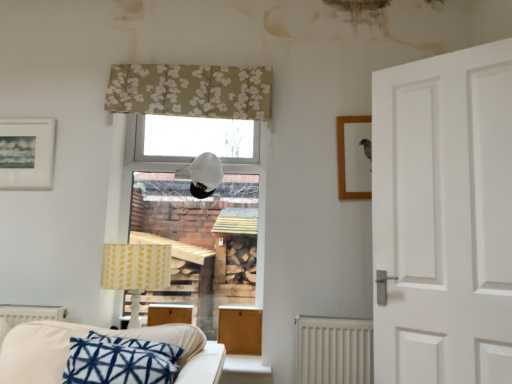
Find the location of a particular element. This screenshot has height=384, width=512. yellow fabric lampshade at lower left, the 2th table lamp viewed from the right is located at coordinates (136, 269).

What do you see at coordinates (240, 329) in the screenshot?
I see `wooden box at center` at bounding box center [240, 329].

The image size is (512, 384). What do you see at coordinates (202, 175) in the screenshot?
I see `white matte table lamp at center, marked as the 1th table lamp in a top-to-bottom arrangement` at bounding box center [202, 175].

Find the location of a particular element. The image size is (512, 384). wooden picture frame at upper right, which is the 1th picture frame from right to left is located at coordinates (354, 157).

The height and width of the screenshot is (384, 512). What are the coordinates of `matte white picture frame at upper left, the second picture frame positioned from the right` in the screenshot? It's located at (26, 154).

What do you see at coordinates (26, 154) in the screenshot? The image size is (512, 384). I see `matte white picture frame at upper left, the second picture frame positioned from the right` at bounding box center [26, 154].

This screenshot has height=384, width=512. What do you see at coordinates (105, 334) in the screenshot?
I see `white fabric couch at lower left` at bounding box center [105, 334].

You are a GUI agent. You are given a task and a screenshot of the screen. Output one action in this format:
    pyautogui.click(x=<x>, y=<y>)
    Task: Click on the yellow fabric lampshade at lower left, which appears as the second table lamp when viewed from the top
    Image resolution: width=512 pixels, height=384 pixels.
    Given the screenshot: What is the action you would take?
    click(x=136, y=269)

Between point (256, 308) and point (329, 369), which one is positioned in front?

The point (329, 369) is closer.

Considering the sizes of wooden box at center and white textured radiator at lower center, acting as the second radiator starting from the left, in the image, is wooden box at center taller or shorter than white textured radiator at lower center, acting as the second radiator starting from the left,?

Considering their sizes, wooden box at center has less height than white textured radiator at lower center, acting as the second radiator starting from the left.

Is wooden box at center not close to white textured radiator at lower center, which appears as the 1th radiator when viewed from the right?

wooden box at center is actually quite close to white textured radiator at lower center, which appears as the 1th radiator when viewed from the right.

From the image's perspective, is wooden box at center above or below white textured radiator at lower center, which appears as the 1th radiator when viewed from the right?

From the image's perspective, wooden box at center appears above white textured radiator at lower center, which appears as the 1th radiator when viewed from the right.

Could you tell me if matte white picture frame at upper left, the second picture frame positioned from the right, is turned towards white textured radiator at lower center, which appears as the 1th radiator when viewed from the right?

No, matte white picture frame at upper left, the second picture frame positioned from the right, is not turned towards white textured radiator at lower center, which appears as the 1th radiator when viewed from the right.

Does matte white picture frame at upper left, the second picture frame positioned from the right, touch white textured radiator at lower center, acting as the second radiator starting from the left?

No, matte white picture frame at upper left, the second picture frame positioned from the right, is not in contact with white textured radiator at lower center, acting as the second radiator starting from the left.

Does matte white picture frame at upper left, arranged as the first picture frame when viewed from the left, contain white textured radiator at lower center, which appears as the 1th radiator when viewed from the right?

Actually, white textured radiator at lower center, which appears as the 1th radiator when viewed from the right, is outside matte white picture frame at upper left, arranged as the first picture frame when viewed from the left.

Which radiator is the 2nd one when counting from the right side of the matte white picture frame at upper left, the second picture frame positioned from the right? Please provide its 2D coordinates.

[(333, 350)]

From a real-world perspective, relative to white fabric couch at lower left, is wooden picture frame at upper right, arranged as the 2th picture frame when viewed from the left, vertically above or below?

wooden picture frame at upper right, arranged as the 2th picture frame when viewed from the left, is above white fabric couch at lower left.

Does wooden picture frame at upper right, which is the 1th picture frame from right to left, touch white fabric couch at lower left?

No, wooden picture frame at upper right, which is the 1th picture frame from right to left, is not with white fabric couch at lower left.

Considering the sizes of objects wooden picture frame at upper right, arranged as the 2th picture frame when viewed from the left, and white fabric couch at lower left in the image provided, who is thinner, wooden picture frame at upper right, arranged as the 2th picture frame when viewed from the left, or white fabric couch at lower left?

wooden picture frame at upper right, arranged as the 2th picture frame when viewed from the left.

Could white fabric couch at lower left be considered to be inside wooden picture frame at upper right, arranged as the 2th picture frame when viewed from the left?

No.

From the picture: Is wooden picture frame at upper right, which is the 1th picture frame from right to left, far from wooden box at center?

No, wooden picture frame at upper right, which is the 1th picture frame from right to left, is not far from wooden box at center.

From the picture: Is wooden box at center located within wooden picture frame at upper right, which is the 1th picture frame from right to left?

That's incorrect, wooden box at center is not inside wooden picture frame at upper right, which is the 1th picture frame from right to left.

Is wooden picture frame at upper right, arranged as the 2th picture frame when viewed from the left, oriented towards wooden box at center?

No, wooden picture frame at upper right, arranged as the 2th picture frame when viewed from the left, is not oriented towards wooden box at center.

Is wooden picture frame at upper right, which is the 1th picture frame from right to left, inside matte white picture frame at upper left, arranged as the first picture frame when viewed from the left?

No, wooden picture frame at upper right, which is the 1th picture frame from right to left, is not inside matte white picture frame at upper left, arranged as the first picture frame when viewed from the left.

Does matte white picture frame at upper left, the second picture frame positioned from the right, turn towards wooden picture frame at upper right, which is the 1th picture frame from right to left?

No, matte white picture frame at upper left, the second picture frame positioned from the right, is not turned towards wooden picture frame at upper right, which is the 1th picture frame from right to left.

In the scene shown: Considering the positions of objects matte white picture frame at upper left, the second picture frame positioned from the right, and wooden picture frame at upper right, arranged as the 2th picture frame when viewed from the left, in the image provided, who is more to the left, matte white picture frame at upper left, the second picture frame positioned from the right, or wooden picture frame at upper right, arranged as the 2th picture frame when viewed from the left,?

From the viewer's perspective, matte white picture frame at upper left, the second picture frame positioned from the right, appears more on the left side.

The height and width of the screenshot is (384, 512). I want to click on radiator directly beneath the white fabric couch at lower left (from a real-world perspective), so click(333, 350).

Which is behind, white fabric couch at lower left or white textured radiator at lower center, which appears as the 1th radiator when viewed from the right?

white textured radiator at lower center, which appears as the 1th radiator when viewed from the right, is more distant.

From a real-world perspective, which is physically above, white fabric couch at lower left or white textured radiator at lower center, which appears as the 1th radiator when viewed from the right?

white fabric couch at lower left is physically above.

Who is taller, white fabric couch at lower left or white textured radiator at lower center, which appears as the 1th radiator when viewed from the right?

With more height is white textured radiator at lower center, which appears as the 1th radiator when viewed from the right.

Consider the image. From the image's perspective, is wooden picture frame at upper right, arranged as the 2th picture frame when viewed from the left, under matte white picture frame at upper left, arranged as the first picture frame when viewed from the left?

Correct, wooden picture frame at upper right, arranged as the 2th picture frame when viewed from the left, appears lower than matte white picture frame at upper left, arranged as the first picture frame when viewed from the left, in the image.

Is wooden picture frame at upper right, which is the 1th picture frame from right to left, not within matte white picture frame at upper left, arranged as the first picture frame when viewed from the left?

Yes, wooden picture frame at upper right, which is the 1th picture frame from right to left, is not within matte white picture frame at upper left, arranged as the first picture frame when viewed from the left.

What are the coordinates of `picture frame that appears below the wooden picture frame at upper right, which is the 1th picture frame from right to left (from a real-world perspective)` in the screenshot? It's located at pyautogui.click(x=26, y=154).

In order to click on furniture to the left of white textured radiator at lower center, which appears as the 1th radiator when viewed from the right in this screenshot , I will do `click(240, 329)`.

Where is `the 2nd picture frame above the white textured radiator at lower center, acting as the second radiator starting from the left (from the image's perspective)`? Image resolution: width=512 pixels, height=384 pixels. the 2nd picture frame above the white textured radiator at lower center, acting as the second radiator starting from the left (from the image's perspective) is located at coordinates (26, 154).

Estimate the real-world distances between objects in this image. Which object is further from white matte table lamp at center, the second table lamp in the bottom-to-top sequence, white fabric couch at lower left or wooden box at center?

white fabric couch at lower left is further to white matte table lamp at center, the second table lamp in the bottom-to-top sequence.

Based on the photo, estimate the real-world distances between objects in this image. Which object is closer to wooden picture frame at upper right, arranged as the 2th picture frame when viewed from the left, beige floral fabric at upper center or white fabric couch at lower left?

The object closer to wooden picture frame at upper right, arranged as the 2th picture frame when viewed from the left, is beige floral fabric at upper center.

Looking at the image, which one is located further to wooden picture frame at upper right, which is the 1th picture frame from right to left, white matte radiator at lower left, which is counted as the first radiator, starting from the left, or wooden box at center?

white matte radiator at lower left, which is counted as the first radiator, starting from the left.

Which object lies further to the anchor point white textured radiator at lower center, which appears as the 1th radiator when viewed from the right, wooden picture frame at upper right, arranged as the 2th picture frame when viewed from the left, or white matte radiator at lower left, which is counted as the first radiator, starting from the left?

white matte radiator at lower left, which is counted as the first radiator, starting from the left, lies further to white textured radiator at lower center, which appears as the 1th radiator when viewed from the right, than the other object.

Looking at the image, which one is located further to white matte radiator at lower left, which is counted as the first radiator, starting from the left, wooden picture frame at upper right, which is the 1th picture frame from right to left, or wooden box at center?

wooden picture frame at upper right, which is the 1th picture frame from right to left.

Considering their positions, is wooden box at center positioned further to beige floral fabric at upper center than white matte table lamp at center, the second table lamp in the bottom-to-top sequence?

wooden box at center lies further to beige floral fabric at upper center than the other object.

Which object lies nearer to the anchor point white fabric couch at lower left, white matte radiator at lower left, positioned as the second radiator in right-to-left order, or white matte table lamp at center, marked as the first table lamp in a right-to-left arrangement?

white matte radiator at lower left, positioned as the second radiator in right-to-left order, is positioned closer to the anchor white fabric couch at lower left.

Considering their positions, is matte white picture frame at upper left, the second picture frame positioned from the right, positioned further to white matte table lamp at center, the second table lamp in the bottom-to-top sequence, than wooden picture frame at upper right, arranged as the 2th picture frame when viewed from the left?

The object further to white matte table lamp at center, the second table lamp in the bottom-to-top sequence, is matte white picture frame at upper left, the second picture frame positioned from the right.

Identify the location of curtain located between matte white picture frame at upper left, the second picture frame positioned from the right, and white matte table lamp at center, marked as the 2th table lamp in a left-to-right arrangement, in the left-right direction. The width and height of the screenshot is (512, 384). (190, 91).

This screenshot has width=512, height=384. I want to click on curtain between white fabric couch at lower left and white matte table lamp at center, marked as the 2th table lamp in a left-to-right arrangement, along the z-axis, so click(190, 91).

Find the location of a particular element. The image size is (512, 384). studio couch between white matte radiator at lower left, positioned as the second radiator in right-to-left order, and white textured radiator at lower center, acting as the second radiator starting from the left, from left to right is located at coordinates (105, 334).

You are a GUI agent. You are given a task and a screenshot of the screen. Output one action in this format:
    pyautogui.click(x=<x>, y=<y>)
    Task: Click on the radiator situated between white matte radiator at lower left, positioned as the second radiator in right-to-left order, and wooden picture frame at upper right, arranged as the 2th picture frame when viewed from the left, from left to right
    The image size is (512, 384).
    Given the screenshot: What is the action you would take?
    pyautogui.click(x=333, y=350)